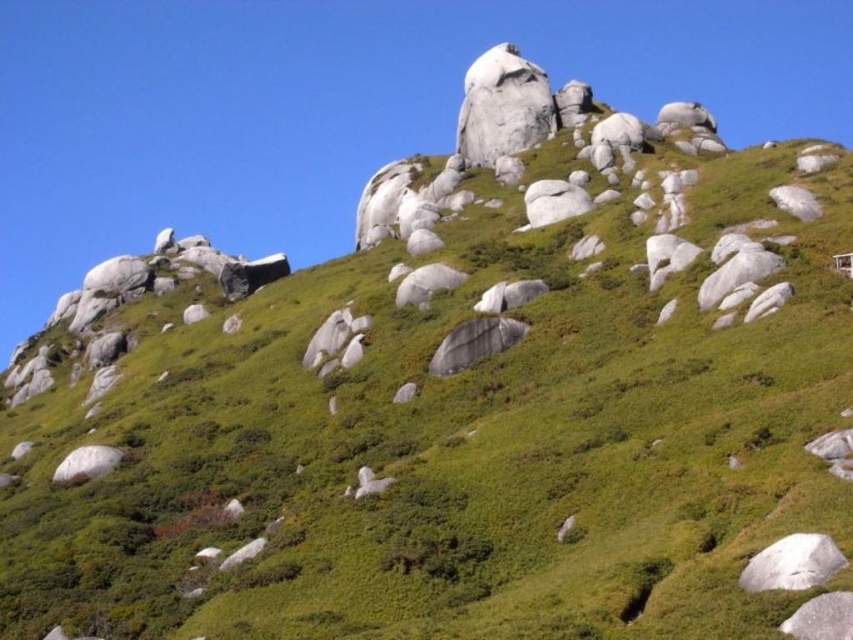
Question: Does white smooth rock at lower right have a larger size compared to smooth gray rock at center?

Choices:
 (A) no
 (B) yes

Answer: (B)

Question: Does white smooth rock at lower right have a smaller size compared to white smooth rock at center?

Choices:
 (A) yes
 (B) no

Answer: (A)

Question: Considering the real-world distances, which object is closest to the smooth gray rock at center?

Choices:
 (A) gray matte rock at center
 (B) white smooth rock at lower left
 (C) white smooth rock at center
 (D) white smooth rock at lower right

Answer: (A)

Question: Can you confirm if white smooth rock at center is positioned above smooth gray rock at center?

Choices:
 (A) no
 (B) yes

Answer: (B)

Question: Which object is closer to the camera taking this photo?

Choices:
 (A) white smooth rock at center
 (B) smooth gray rock at center
 (C) white smooth rock at lower left

Answer: (C)

Question: Which of the following is the closest to the observer?

Choices:
 (A) white smooth rock at lower left
 (B) smooth gray rock at lower right
 (C) gray matte rock at center
 (D) smooth gray rock at center

Answer: (B)